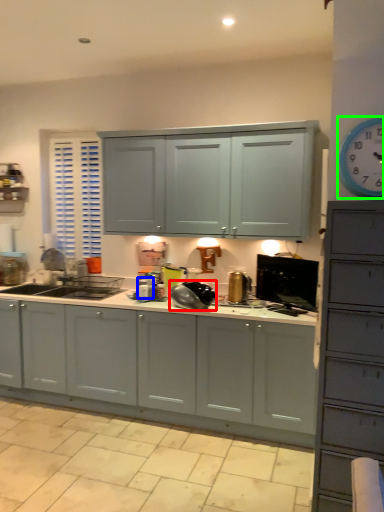
Question: Which is nearer to the appliance (highlighted by a red box)? appliance (highlighted by a blue box) or clock (highlighted by a green box).

Choices:
 (A) appliance
 (B) clock

Answer: (A)